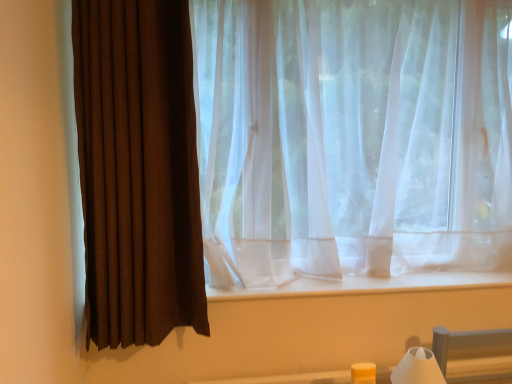
Question: From a real-world perspective, relative to white matte table lamp at lower right, is brown fabric curtain at left vertically above or below?

Choices:
 (A) above
 (B) below

Answer: (A)

Question: Is brown fabric curtain at left taller or shorter than white matte table lamp at lower right?

Choices:
 (A) short
 (B) tall

Answer: (B)

Question: Is brown fabric curtain at left spatially inside white matte table lamp at lower right, or outside of it?

Choices:
 (A) outside
 (B) inside

Answer: (A)

Question: From a real-world perspective, is white matte table lamp at lower right above or below brown fabric curtain at left?

Choices:
 (A) below
 (B) above

Answer: (A)

Question: Is white matte table lamp at lower right taller or shorter than brown fabric curtain at left?

Choices:
 (A) tall
 (B) short

Answer: (B)

Question: Is white matte table lamp at lower right bigger or smaller than brown fabric curtain at left?

Choices:
 (A) small
 (B) big

Answer: (A)

Question: Is white matte table lamp at lower right to the left or to the right of brown fabric curtain at left in the image?

Choices:
 (A) right
 (B) left

Answer: (A)